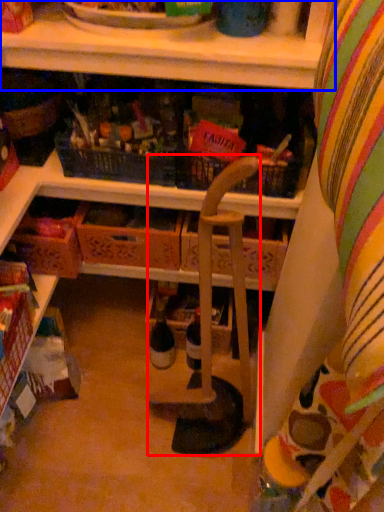
Question: Which of the following is the farthest to the observer, armchair (highlighted by a red box) or shelf (highlighted by a blue box)?

Choices:
 (A) armchair
 (B) shelf

Answer: (B)